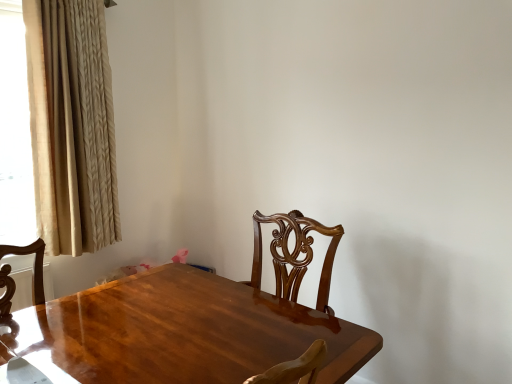
Identify the location of beige textured curtain at left. Image resolution: width=512 pixels, height=384 pixels. (72, 125).

Describe the element at coordinates (72, 125) in the screenshot. I see `beige textured curtain at left` at that location.

Measure the distance between glossy wood table at center and camera.

glossy wood table at center is 1.06 meters away from camera.

The height and width of the screenshot is (384, 512). What do you see at coordinates (181, 332) in the screenshot?
I see `glossy wood table at center` at bounding box center [181, 332].

In order to click on glossy wood table at center in this screenshot , I will do `click(181, 332)`.

Find the location of a particular element. beige textured curtain at left is located at coordinates (72, 125).

Considering the positions of objects beige textured curtain at left and glossy wood table at center in the image provided, who is more to the right, beige textured curtain at left or glossy wood table at center?

From the viewer's perspective, glossy wood table at center appears more on the right side.

Which is in front, beige textured curtain at left or glossy wood table at center?

glossy wood table at center.

Is point (79, 123) closer to camera compared to point (77, 354)?

No, (79, 123) is further to viewer.

From the image's perspective, which one is positioned lower, beige textured curtain at left or glossy wood table at center?

glossy wood table at center, from the image's perspective.

From a real-world perspective, is beige textured curtain at left under glossy wood table at center?

No, from a real-world perspective, beige textured curtain at left is not below glossy wood table at center.

Looking at this image, is beige textured curtain at left wider or thinner than glossy wood table at center?

beige textured curtain at left is thinner than glossy wood table at center.

Is beige textured curtain at left shorter than glossy wood table at center?

Incorrect, the height of beige textured curtain at left does not fall short of that of glossy wood table at center.

Which of these two, beige textured curtain at left or glossy wood table at center, is smaller?

glossy wood table at center is smaller.

Is beige textured curtain at left located outside glossy wood table at center?

Yes, beige textured curtain at left is not within glossy wood table at center.

Can you see beige textured curtain at left touching glossy wood table at center?

No.

Is beige textured curtain at left looking in the opposite direction of glossy wood table at center?

No, beige textured curtain at left is not facing the opposite direction of glossy wood table at center.

How different are the orientations of beige textured curtain at left and glossy wood table at center in degrees?

178 degrees.

Measure the distance between beige textured curtain at left and glossy wood table at center.

They are 3.40 feet apart.

The image size is (512, 384). In order to click on curtain on the left of glossy wood table at center in this screenshot , I will do `click(72, 125)`.

Can you confirm if glossy wood table at center is positioned to the right of beige textured curtain at left?

Yes.

Does glossy wood table at center lie behind beige textured curtain at left?

No, glossy wood table at center is closer to the camera.

Which is behind, point (100, 372) or point (48, 200)?

The point (48, 200) is behind.

From the image's perspective, is glossy wood table at center beneath beige textured curtain at left?

Yes, from the image's perspective, glossy wood table at center is below beige textured curtain at left.

From a real-world perspective, which object rests below the other?

glossy wood table at center is physically lower.

Which of these two, glossy wood table at center or beige textured curtain at left, is wider?

Wider between the two is glossy wood table at center.

Between glossy wood table at center and beige textured curtain at left, which one has less height?

glossy wood table at center.

Is glossy wood table at center bigger than beige textured curtain at left?

No, glossy wood table at center is not bigger than beige textured curtain at left.

Is glossy wood table at center positioned beyond the bounds of beige textured curtain at left?

Yes.

Consider the image. Is glossy wood table at center far away from beige textured curtain at left?

Yes, glossy wood table at center and beige textured curtain at left are quite far apart.

Is glossy wood table at center oriented towards beige textured curtain at left?

Yes, glossy wood table at center is oriented towards beige textured curtain at left.

This screenshot has width=512, height=384. I want to click on curtain above the glossy wood table at center (from a real-world perspective), so click(72, 125).

Identify the location of table that appears in front of the beige textured curtain at left. The width and height of the screenshot is (512, 384). (181, 332).

The height and width of the screenshot is (384, 512). I want to click on table lying below the beige textured curtain at left (from the image's perspective), so click(181, 332).